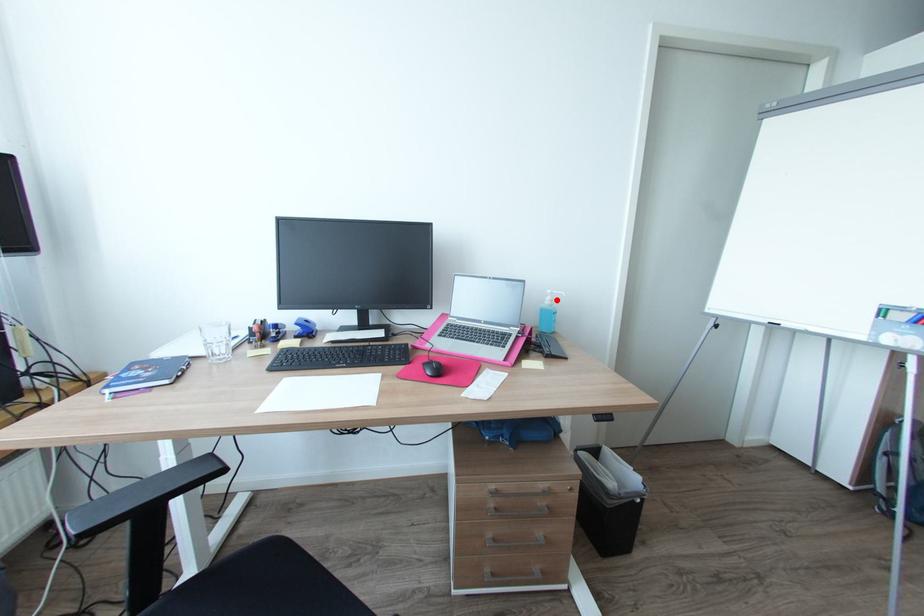
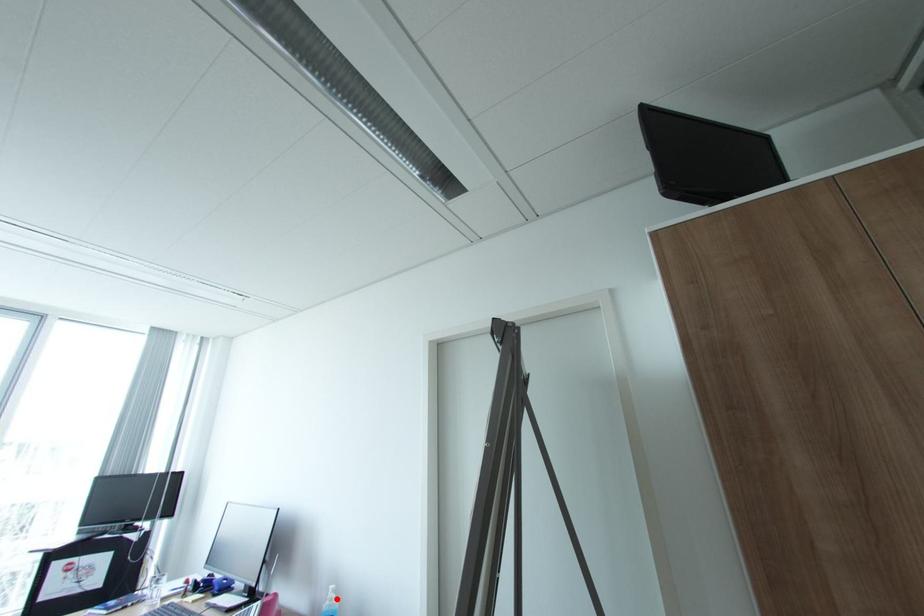
I am providing you with two images of the same scene from different viewpoints. A red point is marked on the first image and another point is marked on the second image. Is the red point in image1 aligned with the point shown in image2?

Yes